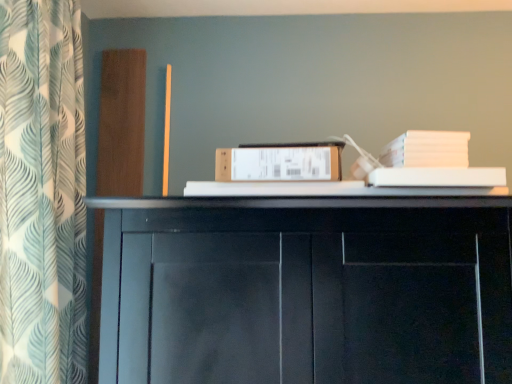
Question: Is white leaf-patterned curtain at left in front of or behind white cardboard box at center in the image?

Choices:
 (A) front
 (B) behind

Answer: (A)

Question: Does point (31, 117) appear closer or farther from the camera than point (298, 175)?

Choices:
 (A) farther
 (B) closer

Answer: (B)

Question: Do you think white leaf-patterned curtain at left is within white cardboard box at center, or outside of it?

Choices:
 (A) outside
 (B) inside

Answer: (A)

Question: Is white cardboard box at center to the left or to the right of white leaf-patterned curtain at left in the image?

Choices:
 (A) left
 (B) right

Answer: (B)

Question: Is white cardboard box at center wider or thinner than white leaf-patterned curtain at left?

Choices:
 (A) thin
 (B) wide

Answer: (A)

Question: From a real-world perspective, is white cardboard box at center above or below white leaf-patterned curtain at left?

Choices:
 (A) above
 (B) below

Answer: (B)

Question: Is white cardboard box at center in front of or behind white leaf-patterned curtain at left in the image?

Choices:
 (A) front
 (B) behind

Answer: (B)